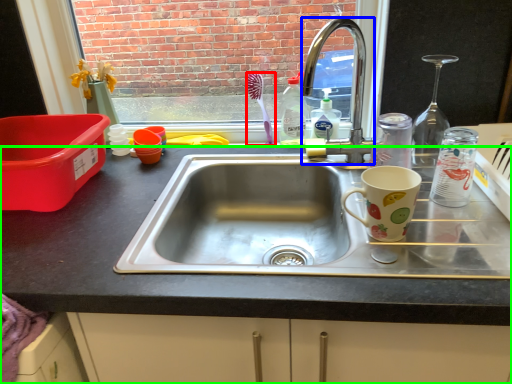
Question: Based on their relative distances, which object is nearer to toothbrush (highlighted by a red box)? Choose from faucet (highlighted by a blue box) and desk (highlighted by a green box).

Choices:
 (A) faucet
 (B) desk

Answer: (A)